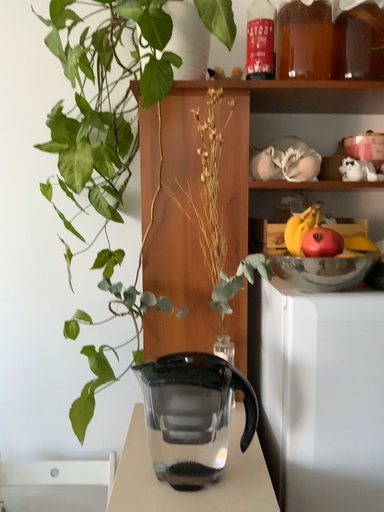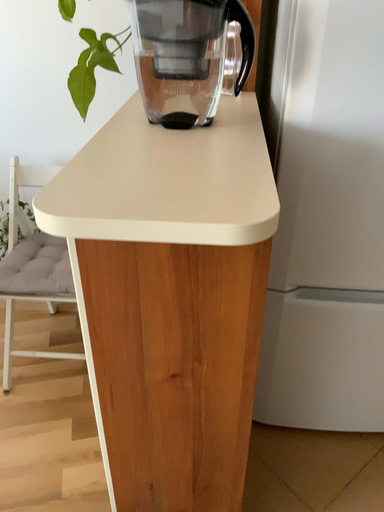
Question: Which way did the camera rotate in the video?

Choices:
 (A) rotated downward
 (B) rotated upward

Answer: (A)